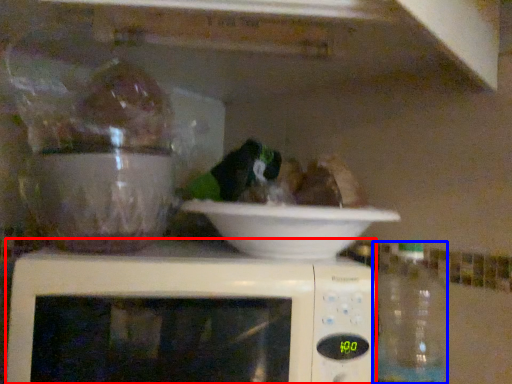
Question: Which of the following is the closest to the observer, microwave oven (highlighted by a red box) or bottle (highlighted by a blue box)?

Choices:
 (A) microwave oven
 (B) bottle

Answer: (A)